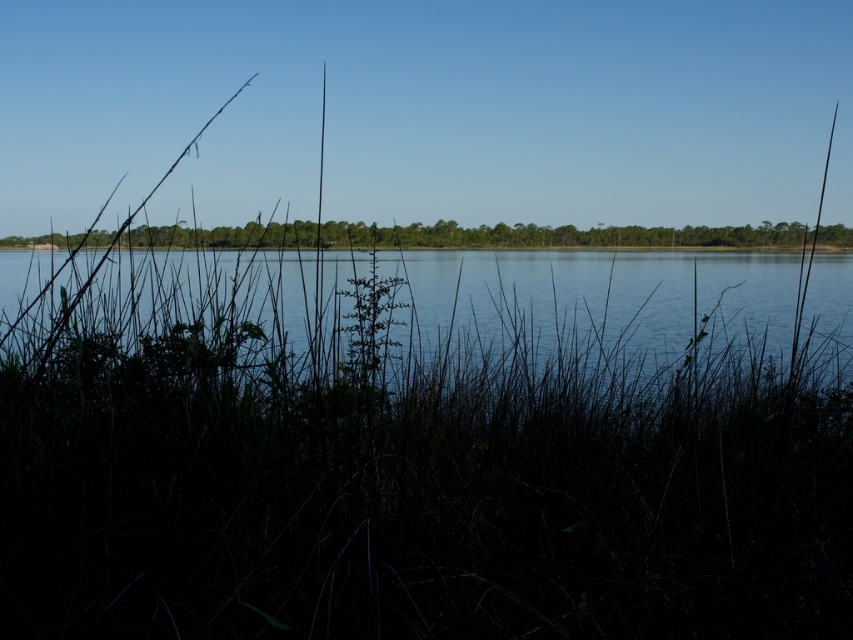
Question: Which object appears farthest from the camera in this image?

Choices:
 (A) green leafy plant at center
 (B) clear water at center
 (C) green matte grass at center

Answer: (A)

Question: Which object is farther from the camera taking this photo?

Choices:
 (A) clear water at center
 (B) green matte grass at center
 (C) green leafy plant at center

Answer: (C)

Question: Is green matte grass at center bigger than green leafy plant at center?

Choices:
 (A) yes
 (B) no

Answer: (A)

Question: Which point is closer to the camera?

Choices:
 (A) coord(328,272)
 (B) coord(349,371)
 (C) coord(18,634)

Answer: (C)

Question: Does green matte grass at center appear on the right side of clear water at center?

Choices:
 (A) yes
 (B) no

Answer: (A)

Question: Observing the image, what is the correct spatial positioning of green matte grass at center in reference to green leafy plant at center?

Choices:
 (A) below
 (B) above

Answer: (A)